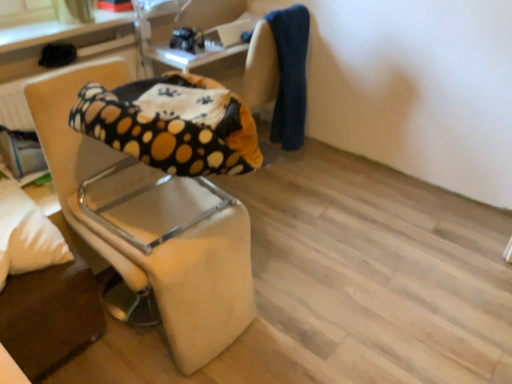
I want to click on beige fabric chair at left, so click(x=151, y=224).

Describe the element at coordinates (151, 224) in the screenshot. The image size is (512, 384). I see `beige fabric chair at left` at that location.

Measure the distance between beige fabric chair at left and camera.

The distance of beige fabric chair at left from camera is 1.30 meters.

Locate an element on the screen. white soft pillow at lower left is located at coordinates (26, 234).

What do you see at coordinates (26, 234) in the screenshot? I see `white soft pillow at lower left` at bounding box center [26, 234].

Find the location of `beige fabric chair at left`. beige fabric chair at left is located at coordinates (151, 224).

Based on their positions, is beige fabric chair at left located to the left or right of white soft pillow at lower left?

beige fabric chair at left is to the right of white soft pillow at lower left.

Is beige fabric chair at left behind white soft pillow at lower left?

No, beige fabric chair at left is closer to the viewer.

Is point (188, 336) in front of point (44, 234)?

That is False.

From the image's perspective, who appears lower, beige fabric chair at left or white soft pillow at lower left?

white soft pillow at lower left appears lower in the image.

From a real-world perspective, is beige fabric chair at left located higher than white soft pillow at lower left?

Actually, beige fabric chair at left is physically below white soft pillow at lower left in the real world.

Considering the relative sizes of beige fabric chair at left and white soft pillow at lower left in the image provided, is beige fabric chair at left thinner than white soft pillow at lower left?

In fact, beige fabric chair at left might be wider than white soft pillow at lower left.

Which of these two, beige fabric chair at left or white soft pillow at lower left, stands taller?

beige fabric chair at left.

Can you confirm if beige fabric chair at left is smaller than white soft pillow at lower left?

No, beige fabric chair at left is not smaller than white soft pillow at lower left.

Is beige fabric chair at left surrounding white soft pillow at lower left?

No, white soft pillow at lower left is not inside beige fabric chair at left.

Would you consider beige fabric chair at left to be distant from white soft pillow at lower left?

That's not correct — beige fabric chair at left is a little close to white soft pillow at lower left.

Is beige fabric chair at left facing away from white soft pillow at lower left?

No.

Locate an element on the screen. The width and height of the screenshot is (512, 384). pillow that appears below the beige fabric chair at left (from the image's perspective) is located at coordinates (26, 234).

Considering the relative positions of white soft pillow at lower left and beige fabric chair at left in the image provided, is white soft pillow at lower left to the right of beige fabric chair at left from the viewer's perspective?

In fact, white soft pillow at lower left is to the left of beige fabric chair at left.

Is the depth of white soft pillow at lower left greater than that of beige fabric chair at left?

Yes, it is behind beige fabric chair at left.

Which is nearer, (19, 195) or (191, 268)?

Clearly, point (19, 195) is more distant from the camera than point (191, 268).

From the image's perspective, which is above, white soft pillow at lower left or beige fabric chair at left?

From the image's view, beige fabric chair at left is above.

From a real-world perspective, does white soft pillow at lower left stand above beige fabric chair at left?

Indeed, from a real-world perspective, white soft pillow at lower left stands above beige fabric chair at left.

Which of these two, white soft pillow at lower left or beige fabric chair at left, is thinner?

white soft pillow at lower left.

From the picture: Can you confirm if white soft pillow at lower left is taller than beige fabric chair at left?

No, white soft pillow at lower left is not taller than beige fabric chair at left.

Between white soft pillow at lower left and beige fabric chair at left, which one has smaller size?

white soft pillow at lower left.

Based on the photo, can beige fabric chair at left be found inside white soft pillow at lower left?

No, beige fabric chair at left is located outside of white soft pillow at lower left.

Is white soft pillow at lower left touching beige fabric chair at left?

No, white soft pillow at lower left is not beside beige fabric chair at left.

Could you tell me if white soft pillow at lower left is facing beige fabric chair at left?

No, white soft pillow at lower left is not aimed at beige fabric chair at left.

The image size is (512, 384). I want to click on chair in front of the white soft pillow at lower left, so click(x=151, y=224).

Image resolution: width=512 pixels, height=384 pixels. In order to click on chair located on the right of white soft pillow at lower left in this screenshot , I will do `click(151, 224)`.

You are a GUI agent. You are given a task and a screenshot of the screen. Output one action in this format:
    pyautogui.click(x=<x>, y=<y>)
    Task: Click on the chair lying above the white soft pillow at lower left (from the image's perspective)
    This screenshot has height=384, width=512.
    Given the screenshot: What is the action you would take?
    pyautogui.click(x=151, y=224)